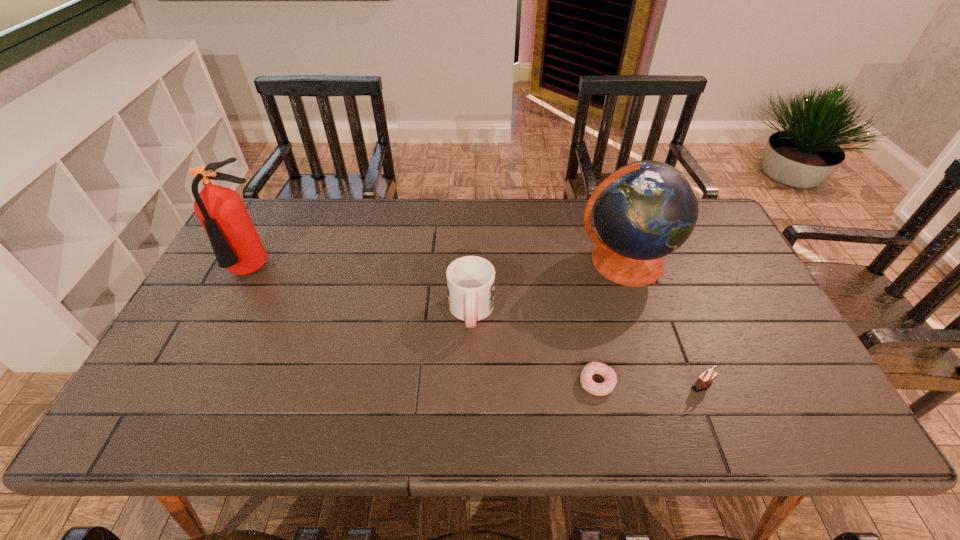
Find the location of a particular element. Image resolution: width=960 pixels, height=540 pixels. vacant area situated 0.270m on the right of the shortest object is located at coordinates (730, 382).

Where is `object present at the far edge`? object present at the far edge is located at coordinates (645, 210).

Image resolution: width=960 pixels, height=540 pixels. What are the coordinates of `object that is at the left edge` in the screenshot? It's located at (237, 247).

Find the location of a particular element. The width and height of the screenshot is (960, 540). vacant space at the far edge of the desktop is located at coordinates (340, 208).

The height and width of the screenshot is (540, 960). In the image, there is a desktop. In order to click on free space at the near edge in this screenshot , I will do `click(638, 418)`.

Identify the location of free space at the left edge. (224, 323).

You are a GUI agent. You are given a task and a screenshot of the screen. Output one action in this format:
    pyautogui.click(x=<x>, y=<y>)
    Task: Click on the vacant region at the right edge of the desktop
    
    Given the screenshot: What is the action you would take?
    pyautogui.click(x=750, y=319)

This screenshot has width=960, height=540. Find the location of `vacant space in between the doughnut and the mug`. vacant space in between the doughnut and the mug is located at coordinates (534, 347).

Where is `unoccupied position between the padlock and the globe`? This screenshot has width=960, height=540. unoccupied position between the padlock and the globe is located at coordinates (662, 323).

At what (x,y) coordinates should I click in order to perform the action: click on free space between the doughnut and the mug. Please return your answer as a coordinate pair (x, y). This screenshot has width=960, height=540. Looking at the image, I should click on (534, 347).